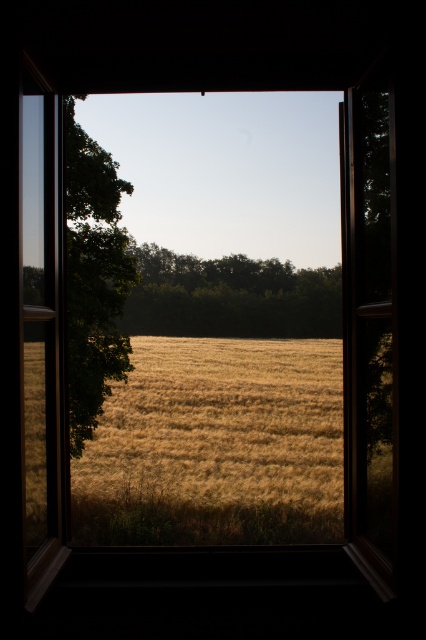
Question: Is green leafy tree at left wider than green leafy tree at center?

Choices:
 (A) yes
 (B) no

Answer: (B)

Question: Can you confirm if green leafy tree at left is smaller than green leafy tree at center?

Choices:
 (A) no
 (B) yes

Answer: (B)

Question: Which object appears farthest from the camera in this image?

Choices:
 (A) green leafy tree at center
 (B) green leafy tree at left

Answer: (A)

Question: Is the position of green leafy tree at left less distant than that of green leafy tree at center?

Choices:
 (A) yes
 (B) no

Answer: (A)

Question: Among these points, which one is nearest to the camera?

Choices:
 (A) pos(129,356)
 (B) pos(218,296)

Answer: (A)